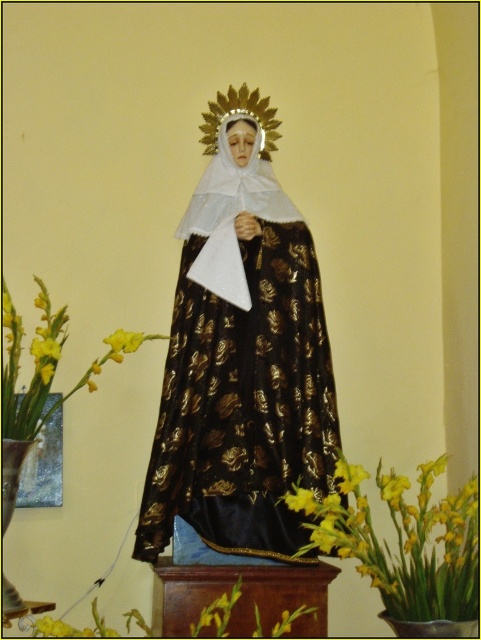
This screenshot has height=640, width=481. What do you see at coordinates (349, 476) in the screenshot?
I see `yellow matte flower at center` at bounding box center [349, 476].

Measure the distance between yellow matte flower at center and yellow matte flower at lower center.

A distance of 3.71 inches exists between yellow matte flower at center and yellow matte flower at lower center.

Where is `yellow matte flower at center`? yellow matte flower at center is located at coordinates (349, 476).

Is point (326, 435) farther from viewer compared to point (290, 493)?

Yes.

What do you see at coordinates (241, 355) in the screenshot?
I see `shiny gold fabric statue at center` at bounding box center [241, 355].

At what (x,y) coordinates should I click in order to perform the action: click on shiny gold fabric statue at center. Please return your answer as a coordinate pair (x, y). Looking at the image, I should click on (241, 355).

Is point (380, 477) positioned before point (307, 504)?

No, it is behind (307, 504).

Is point (428, 566) more distant than point (303, 502)?

Yes, it is behind point (303, 502).

The image size is (481, 640). What do you see at coordinates (407, 545) in the screenshot?
I see `yellow glossy flowers at lower right` at bounding box center [407, 545].

Where is `yellow glossy flowers at lower right`? This screenshot has height=640, width=481. yellow glossy flowers at lower right is located at coordinates (407, 545).